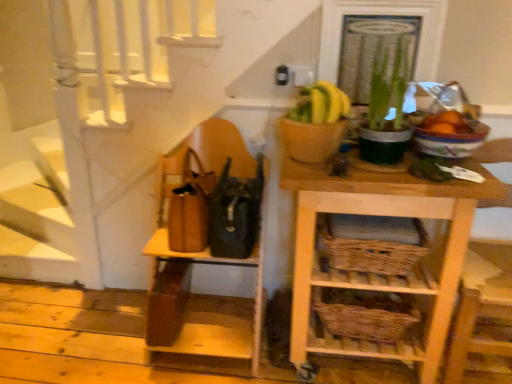
Question: Would you say light wood wicker basket at center right, the 1th shelf viewed from the right, is to the left or to the right of woven brown basket at lower center, which is the first basket from top to bottom, in the picture?

Choices:
 (A) left
 (B) right

Answer: (A)

Question: In the image, is light wood wicker basket at center right, which ranks as the 2th shelf in left-to-right order, positioned in front of or behind woven brown basket at lower center, which appears as the second basket when ordered from the bottom?

Choices:
 (A) front
 (B) behind

Answer: (A)

Question: Estimate the real-world distances between objects in this image. Which object is closer to the brown leather shelf at left, the 2th shelf from the right?

Choices:
 (A) woven brown basket at lower center, which is the second basket from top to bottom
 (B) light wood wicker basket at center right, the 1th shelf viewed from the right
 (C) wooden chair at right
 (D) green leafy plant at upper right
 (E) black leather bag at center

Answer: (E)

Question: Which is nearer to the woven brown basket at lower center, which appears as the second basket when ordered from the bottom?

Choices:
 (A) brown leather shelf at left, which is the 1th shelf in left-to-right order
 (B) wooden chair at right
 (C) woven brown basket at lower center, which is the second basket from top to bottom
 (D) light wood wicker basket at center right, the 1th shelf viewed from the right
 (E) black leather bag at center

Answer: (D)